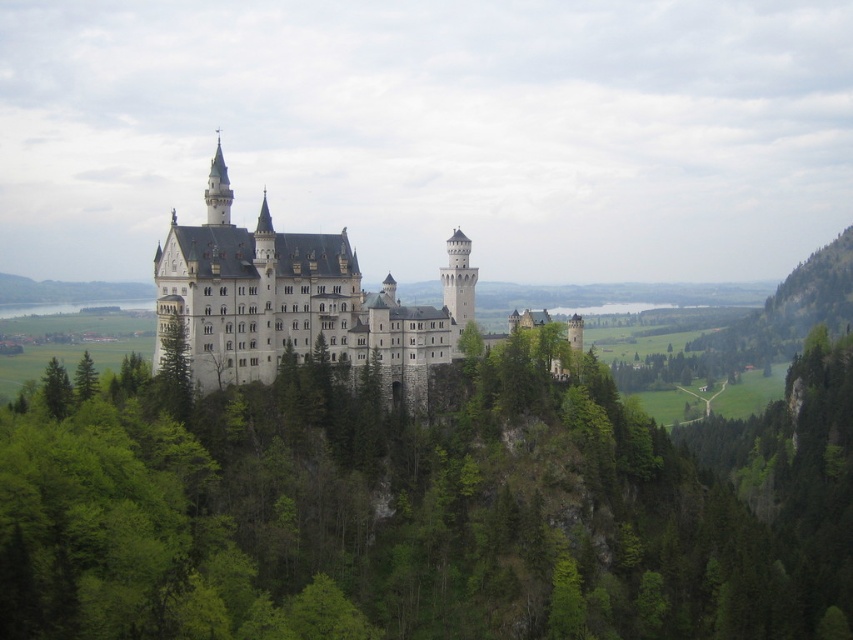
The height and width of the screenshot is (640, 853). In order to click on white stone castle at center in this screenshot , I will do `click(297, 300)`.

Between white stone castle at center and green leafy tree at lower left, which one has less height?

Standing shorter between the two is green leafy tree at lower left.

Describe the element at coordinates (297, 300) in the screenshot. I see `white stone castle at center` at that location.

Where is `white stone castle at center`? white stone castle at center is located at coordinates (297, 300).

Can you confirm if white stone castle at center is thinner than green matte tree at lower left?

Incorrect, white stone castle at center's width is not less than green matte tree at lower left's.

Image resolution: width=853 pixels, height=640 pixels. Describe the element at coordinates (297, 300) in the screenshot. I see `white stone castle at center` at that location.

The height and width of the screenshot is (640, 853). Find the location of `white stone castle at center`. white stone castle at center is located at coordinates (297, 300).

Between white stone castle at center and green textured tree at center, which one appears on the right side from the viewer's perspective?

From the viewer's perspective, white stone castle at center appears more on the right side.

Between point (184, 244) and point (160, 396), which one is positioned in front?

Positioned in front is point (160, 396).

This screenshot has width=853, height=640. I want to click on white stone castle at center, so click(x=297, y=300).